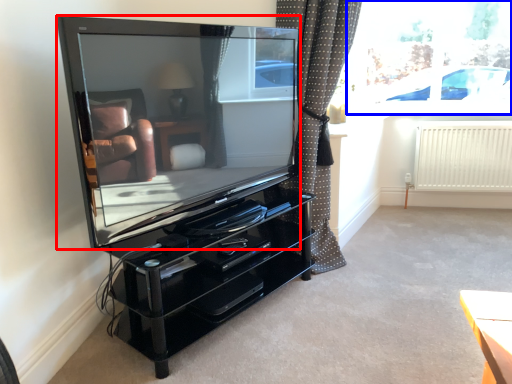
Question: Among these objects, which one is nearest to the camera, television (highlighted by a red box) or window screen (highlighted by a blue box)?

Choices:
 (A) television
 (B) window screen

Answer: (A)